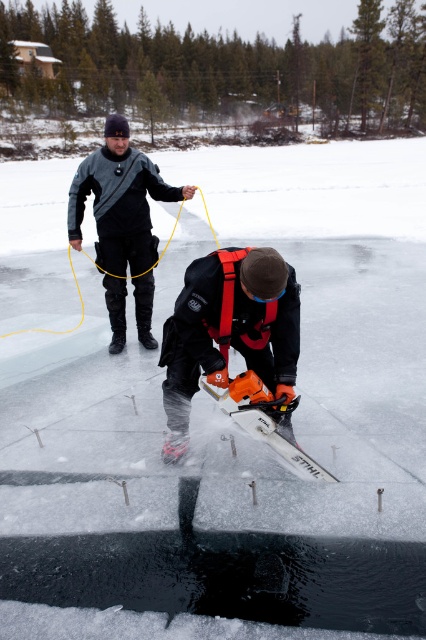
You are observing two workers on a frozen lake. You notice the orange rubber gloves at center and the matte black jacket at upper center. Which object is located to the right of the other?

The orange rubber gloves at center is positioned on the right side of matte black jacket at upper center.

You are a safety inspector checking the equipment of workers on the ice. You notice the orange rubber gloves at center and the matte black jacket at upper center. Which piece of equipment is thinner?

The orange rubber gloves at center is thinner than the matte black jacket at upper center according to the description.

You are a safety inspector checking the scene. You notice the person using a chainsaw on the ice. According to safety guidelines, workers must wear protective gloves. Are the orange rubber gloves at center being used properly by the worker?

The orange rubber gloves at center are located at point (229, 330), which is near the worker operating the chainsaw. Since the worker is using a chainsaw, which requires protective gloves, the orange rubber gloves at center should be worn by the worker for safety. However, the description does not explicitly state that the worker is wearing them, so it is unclear if they are being used properly.